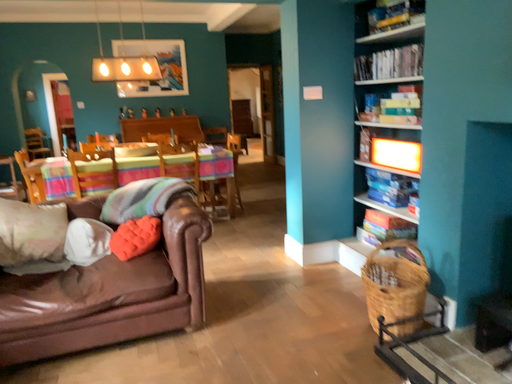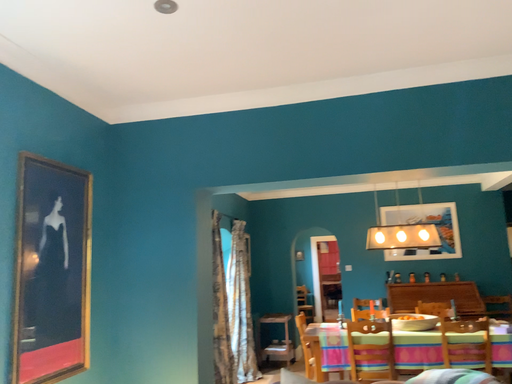
Question: Which way did the camera rotate in the video?

Choices:
 (A) rotated right
 (B) rotated left

Answer: (B)